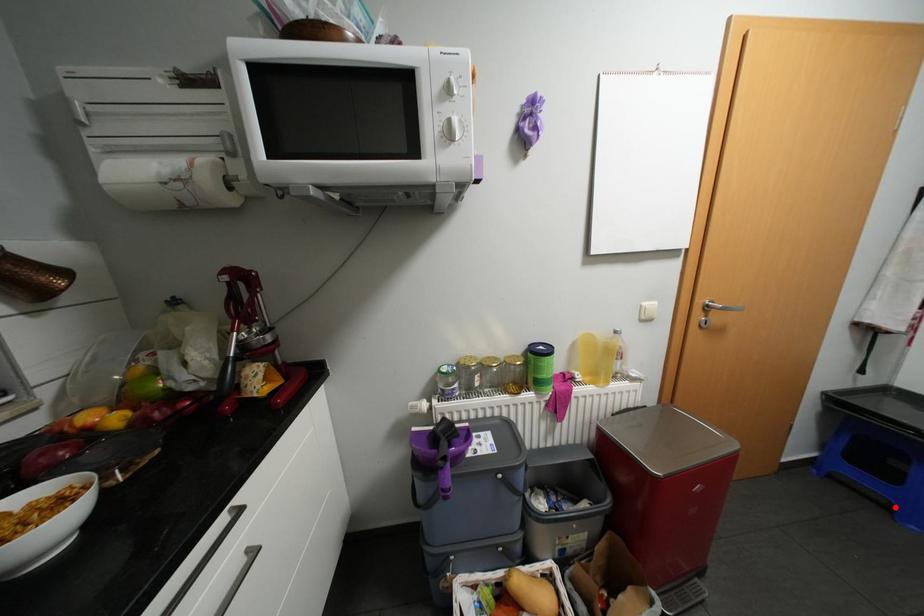
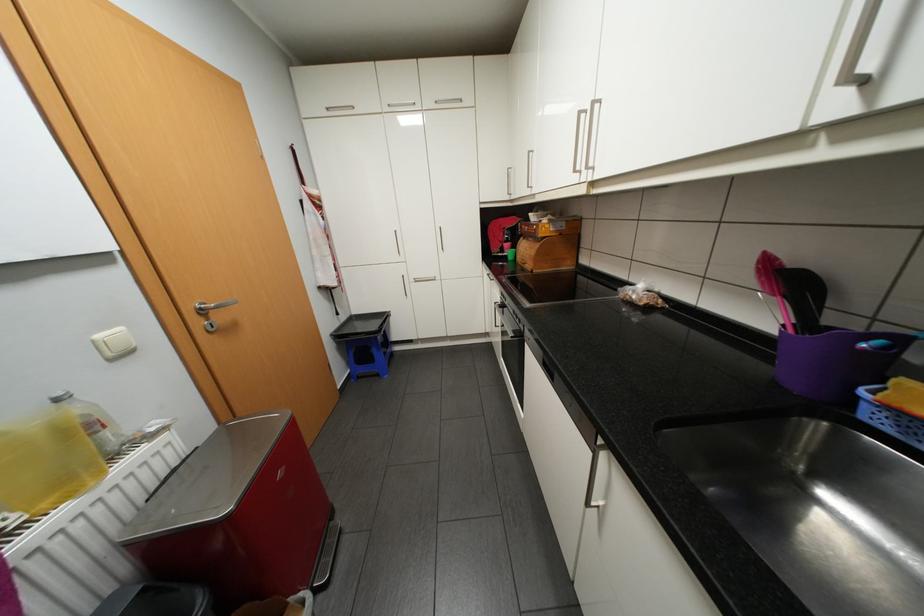
The point at the highlighted location is marked in the first image. Where is the corresponding point in the second image?

(385, 374)